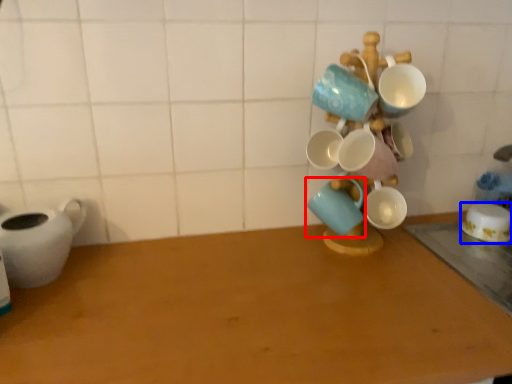
Question: Which point is closer to the camera, coffee cup (highlighted by a red box) or coffee cup (highlighted by a blue box)?

Choices:
 (A) coffee cup
 (B) coffee cup

Answer: (A)